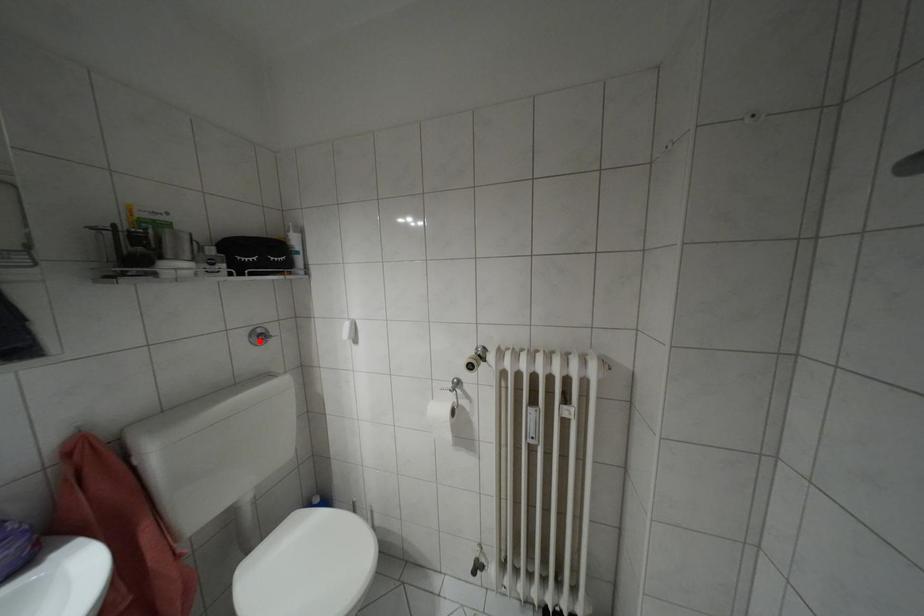
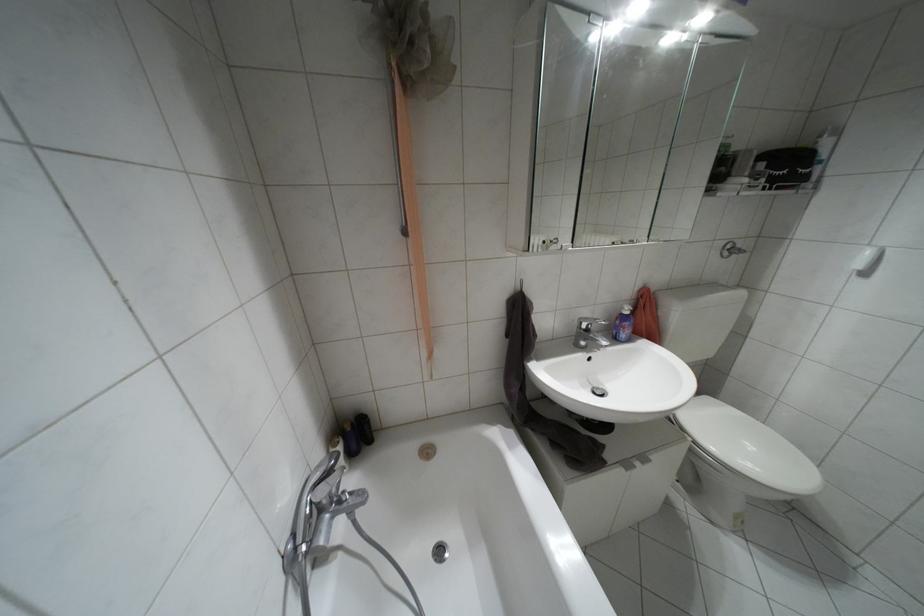
Locate, in the second image, the point that corresponds to the highlighted location in the first image.

(723, 254)